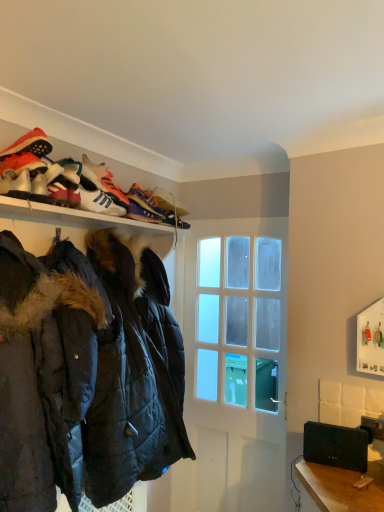
Describe the element at coordinates (22, 164) in the screenshot. I see `red suede sneaker at upper left, which is counted as the third footwear, starting from the back` at that location.

Describe the element at coordinates (144, 200) in the screenshot. The width and height of the screenshot is (384, 512). I see `multicolored fabric shoe at upper center, which is the 2th shoe from front to back` at that location.

Where is `matte black shoes at upper center, positioned as the 4th footwear in front-to-back order`? matte black shoes at upper center, positioned as the 4th footwear in front-to-back order is located at coordinates (155, 208).

The height and width of the screenshot is (512, 384). What are the coordinates of `white leather sneakers at upper center, which appears as the third footwear when viewed from the front` in the screenshot? It's located at pyautogui.click(x=114, y=190).

Which of these two, white leather sneakers at upper left, arranged as the 1th footwear when viewed from the front, or clear glass door at center, stands shorter?

With less height is white leather sneakers at upper left, arranged as the 1th footwear when viewed from the front.

This screenshot has height=512, width=384. Identify the location of glass door below the white leather sneakers at upper left, arranged as the 1th footwear when viewed from the front (from the image's perspective). (231, 367).

Looking at this image, considering the relative sizes of white leather sneakers at upper left, arranged as the 1th footwear when viewed from the front, and clear glass door at center in the image provided, is white leather sneakers at upper left, arranged as the 1th footwear when viewed from the front, wider than clear glass door at center?

Yes, white leather sneakers at upper left, arranged as the 1th footwear when viewed from the front, is wider than clear glass door at center.

Is white leather sneakers at upper left, arranged as the 1th footwear when viewed from the front, in front of or behind clear glass door at center in the image?

white leather sneakers at upper left, arranged as the 1th footwear when viewed from the front, is in front of clear glass door at center.

In terms of size, does white leather sneakers at upper center, placed as the second footwear when sorted from back to front, appear bigger or smaller than red suede sneaker at upper left, which appears as the second footwear when viewed from the front?

In the image, white leather sneakers at upper center, placed as the second footwear when sorted from back to front, appears to be larger than red suede sneaker at upper left, which appears as the second footwear when viewed from the front.

Looking at this image, from the image's perspective, who appears lower, white leather sneakers at upper center, placed as the second footwear when sorted from back to front, or red suede sneaker at upper left, which is counted as the third footwear, starting from the back?

red suede sneaker at upper left, which is counted as the third footwear, starting from the back, from the image's perspective.

From the picture: Which is behind, white leather sneakers at upper center, which appears as the third footwear when viewed from the front, or red suede sneaker at upper left, which is counted as the third footwear, starting from the back?

white leather sneakers at upper center, which appears as the third footwear when viewed from the front, is behind.

Is dark blue quilted jacket at left oriented away from clear glass door at center?

That's not correct — dark blue quilted jacket at left is not looking away from clear glass door at center.

Considering the positions of point (39, 382) and point (205, 380), is point (39, 382) closer or farther from the camera than point (205, 380)?

Point (39, 382) is closer to the camera than point (205, 380).

From the image's perspective, is dark blue quilted jacket at left beneath clear glass door at center?

No, from the image's perspective, dark blue quilted jacket at left is not beneath clear glass door at center.

Which of these two, clear glass door at center or multicolored fabric shoe at upper center, which ranks as the first shoe in back-to-front order, is thinner?

Thinner between the two is clear glass door at center.

Considering the positions of objects clear glass door at center and multicolored fabric shoe at upper center, which ranks as the first shoe in back-to-front order, in the image provided, who is more to the right, clear glass door at center or multicolored fabric shoe at upper center, which ranks as the first shoe in back-to-front order,?

From the viewer's perspective, clear glass door at center appears more on the right side.

Can you tell me how much clear glass door at center and multicolored fabric shoe at upper center, which is the 2th shoe from front to back, differ in facing direction?

87.2 degrees separate the facing orientations of clear glass door at center and multicolored fabric shoe at upper center, which is the 2th shoe from front to back.

Is clear glass door at center looking in the opposite direction of white leather sneakers at upper left, arranged as the 1th footwear when viewed from the front?

No, clear glass door at center is not facing the opposite direction of white leather sneakers at upper left, arranged as the 1th footwear when viewed from the front.

Is point (180, 484) positioned before point (19, 197)?

No, it is not.

Is clear glass door at center to the right of white leather sneakers at upper left, arranged as the 1th footwear when viewed from the front, from the viewer's perspective?

Yes, clear glass door at center is to the right of white leather sneakers at upper left, arranged as the 1th footwear when viewed from the front.

Can you confirm if clear glass door at center is taller than white leather sneakers at upper left, arranged as the 1th footwear when viewed from the front?

Correct, clear glass door at center is much taller as white leather sneakers at upper left, arranged as the 1th footwear when viewed from the front.

From the picture: Would you say multicolored fabric shoe at upper center, which ranks as the first shoe in back-to-front order, is to the left or to the right of white leather sneakers at upper left, arranged as the 1th footwear when viewed from the front, in the picture?

From the image, it's evident that multicolored fabric shoe at upper center, which ranks as the first shoe in back-to-front order, is to the right of white leather sneakers at upper left, arranged as the 1th footwear when viewed from the front.

What's the angular difference between multicolored fabric shoe at upper center, which is the 2th shoe from front to back, and white leather sneakers at upper left, arranged as the 1th footwear when viewed from the front,'s facing directions?

The angular difference between multicolored fabric shoe at upper center, which is the 2th shoe from front to back, and white leather sneakers at upper left, arranged as the 1th footwear when viewed from the front, is 0.00981 degrees.

Between point (153, 197) and point (29, 175), which one is positioned in front?

The point (29, 175) is in front.

Who is taller, multicolored fabric shoe at upper center, which is the 2th shoe from front to back, or white leather sneakers at upper left, which is the fourth footwear from back to front?

multicolored fabric shoe at upper center, which is the 2th shoe from front to back.

Does clear glass door at center appear on the left side of white matte shoe rack at upper left?

No, clear glass door at center is not to the left of white matte shoe rack at upper left.

Identify the location of glass door lying on the right of white matte shoe rack at upper left. This screenshot has width=384, height=512. (231, 367).

Is clear glass door at center situated inside white matte shoe rack at upper left or outside?

clear glass door at center exists outside the volume of white matte shoe rack at upper left.

Where is `the 4th footwear to the left of the clear glass door at center, starting your count from the anchor`? the 4th footwear to the left of the clear glass door at center, starting your count from the anchor is located at coordinates (16, 184).

The height and width of the screenshot is (512, 384). Find the location of `footwear that is the 1st one when counting rightward from the red suede sneaker at upper left, which appears as the second footwear when viewed from the front`. footwear that is the 1st one when counting rightward from the red suede sneaker at upper left, which appears as the second footwear when viewed from the front is located at coordinates coord(114,190).

Looking at the image, which one is located further to matte black shoes at upper center, positioned as the 4th footwear in front-to-back order, multicolored fabric shoe at upper center, which is the 2th shoe from front to back, or clear glass door at center?

Among the two, clear glass door at center is located further to matte black shoes at upper center, positioned as the 4th footwear in front-to-back order.

Based on their spatial positions, is matte black shoes at upper center, positioned as the 4th footwear in front-to-back order, or clear glass door at center further from multicolored fabric shoe at upper center, which is the 2th shoe from front to back?

The object further to multicolored fabric shoe at upper center, which is the 2th shoe from front to back, is clear glass door at center.

In the scene shown: Considering their positions, is multicolored fabric shoe at upper center, which ranks as the first shoe in back-to-front order, positioned closer to red suede sneaker at upper left, which appears as the second footwear when viewed from the front, than clear glass door at center?

The object closer to red suede sneaker at upper left, which appears as the second footwear when viewed from the front, is multicolored fabric shoe at upper center, which ranks as the first shoe in back-to-front order.

From the image, which object appears to be nearer to dark blue quilted jacket at left, white leather sneakers at upper center, placed as the second footwear when sorted from back to front, or white leather sneakers at upper center, the 1th shoe positioned from the front?

white leather sneakers at upper center, the 1th shoe positioned from the front, lies closer to dark blue quilted jacket at left than the other object.

Estimate the real-world distances between objects in this image. Which object is closer to white leather sneakers at upper left, which is the fourth footwear from back to front, dark blue quilted jacket at left or red suede sneaker at upper left, which appears as the second footwear when viewed from the front?

red suede sneaker at upper left, which appears as the second footwear when viewed from the front, is closer to white leather sneakers at upper left, which is the fourth footwear from back to front.

From the image, which object appears to be farther from multicolored fabric shoe at upper center, which is the 2th shoe from front to back, white leather sneakers at upper center, the 1th shoe positioned from the front, or clear glass door at center?

Based on the image, clear glass door at center appears to be further to multicolored fabric shoe at upper center, which is the 2th shoe from front to back.

When comparing their distances from multicolored fabric shoe at upper center, which ranks as the first shoe in back-to-front order, does white matte shoe rack at upper left or dark blue quilted jacket at left seem further?

Based on the image, dark blue quilted jacket at left appears to be further to multicolored fabric shoe at upper center, which ranks as the first shoe in back-to-front order.

When comparing their distances from white leather sneakers at upper left, arranged as the 1th footwear when viewed from the front, does white leather sneakers at upper center, marked as the 2th shoe in a back-to-front arrangement, or white matte shoe rack at upper left seem further?

white matte shoe rack at upper left lies further to white leather sneakers at upper left, arranged as the 1th footwear when viewed from the front, than the other object.

This screenshot has height=512, width=384. I want to click on shelf positioned between white leather sneakers at upper left, arranged as the 1th footwear when viewed from the front, and multicolored fabric shoe at upper center, which is the 2th shoe from front to back, from near to far, so click(87, 221).

At what (x,y) coordinates should I click in order to perform the action: click on shelf between matte black shoes at upper center, positioned as the 4th footwear in front-to-back order, and clear glass door at center, in the vertical direction. Please return your answer as a coordinate pair (x, y). This screenshot has width=384, height=512. Looking at the image, I should click on pos(87,221).

Locate an element on the screen. footwear between white leather sneakers at upper center, marked as the 2th shoe in a back-to-front arrangement, and clear glass door at center from top to bottom is located at coordinates (155, 208).

I want to click on shelf that lies between white leather sneakers at upper center, placed as the second footwear when sorted from back to front, and clear glass door at center from top to bottom, so click(87, 221).